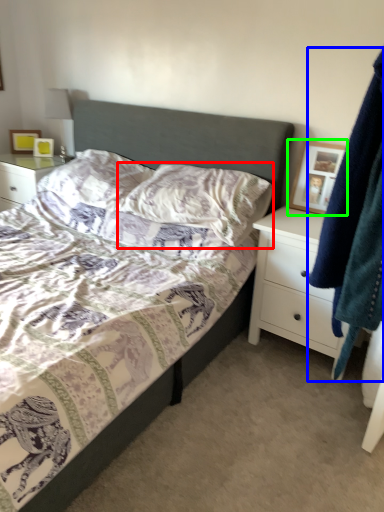
Question: Which object is positioned closest to pillow (highlighted by a red box)? Select from clothing (highlighted by a blue box) and picture frame (highlighted by a green box).

Choices:
 (A) clothing
 (B) picture frame

Answer: (B)